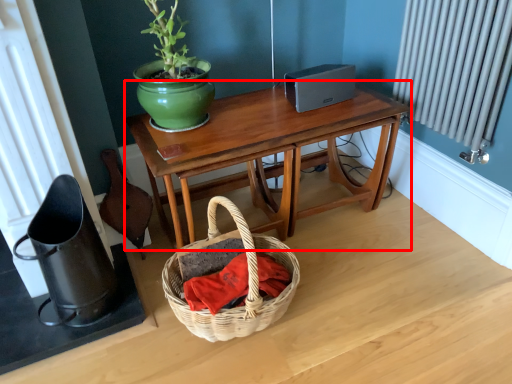
Question: In this image, where is table (annotated by the red box) located relative to material?

Choices:
 (A) left
 (B) right

Answer: (B)